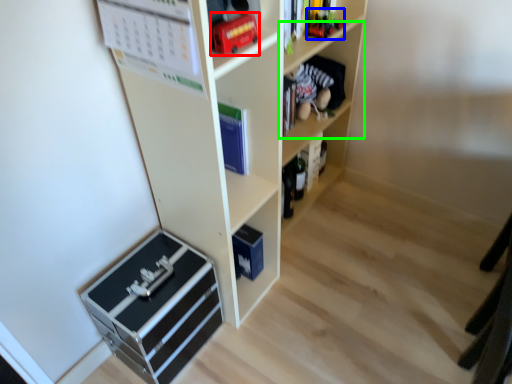
Question: Estimate the real-world distances between objects in this image. Which object is farther from toy (highlighted by a red box), toy (highlighted by a blue box) or shelf (highlighted by a green box)?

Choices:
 (A) toy
 (B) shelf

Answer: (B)